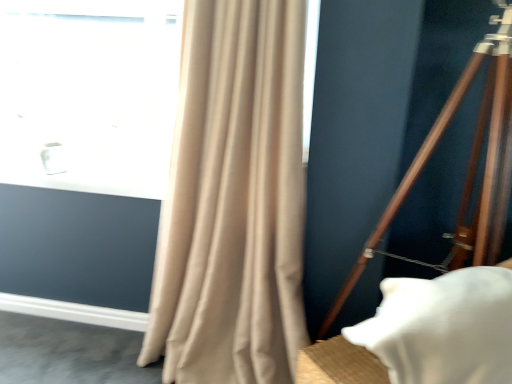
Question: Considering their positions, is wooden tripod at right located in front of or behind white matte pillow at lower right?

Choices:
 (A) front
 (B) behind

Answer: (B)

Question: Visually, is wooden tripod at right positioned to the left or to the right of white matte pillow at lower right?

Choices:
 (A) left
 (B) right

Answer: (B)

Question: Based on their relative distances, which object is nearer to the white matte pillow at lower right?

Choices:
 (A) transparent glass window at upper left
 (B) beige fabric curtain at left
 (C) wooden tripod at right

Answer: (C)

Question: Which object is positioned closest to the wooden tripod at right?

Choices:
 (A) transparent glass window at upper left
 (B) white matte pillow at lower right
 (C) beige fabric curtain at left

Answer: (C)